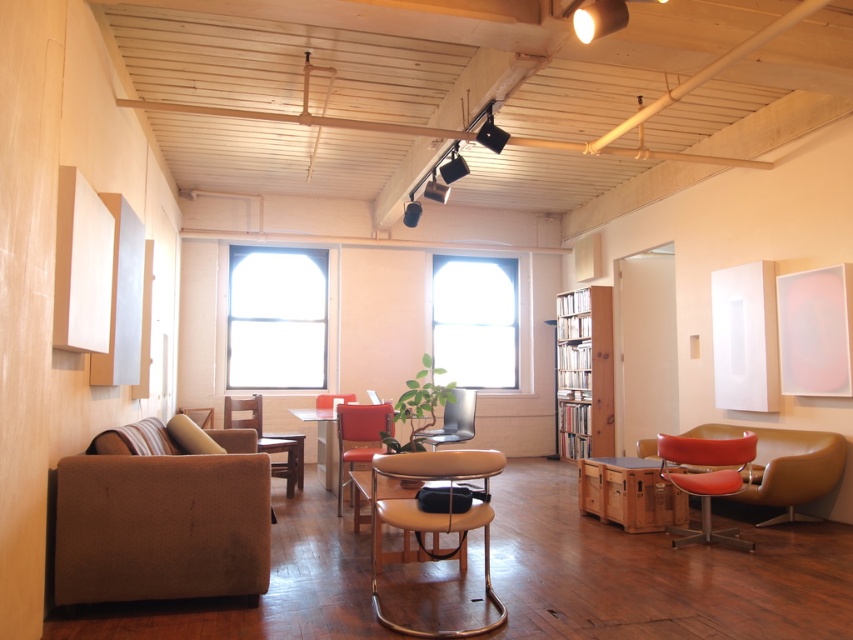
Question: Which of these objects is positioned farthest from the brown leather armchair at center?

Choices:
 (A) wooden bookshelf at right
 (B) leather-like beige chair at center
 (C) matte orange swivel chair at lower right

Answer: (A)

Question: Is leather-like orange chair at right bigger than matte glass table at center?

Choices:
 (A) no
 (B) yes

Answer: (A)

Question: Is matte orange swivel chair at lower right bigger than matte glass table at center?

Choices:
 (A) no
 (B) yes

Answer: (A)

Question: Among these objects, which one is farthest from the camera?

Choices:
 (A) brown fabric couch at lower left
 (B) leather-like beige chair at center
 (C) wooden bookshelf at right
 (D) transparent glass window at center

Answer: (D)

Question: Does brown fabric couch at lower left appear on the right side of brown leather armchair at center?

Choices:
 (A) no
 (B) yes

Answer: (B)

Question: Which object is positioned closest to the matte orange swivel chair at lower right?

Choices:
 (A) transparent glass window at center
 (B) metallic silver chair at center

Answer: (B)